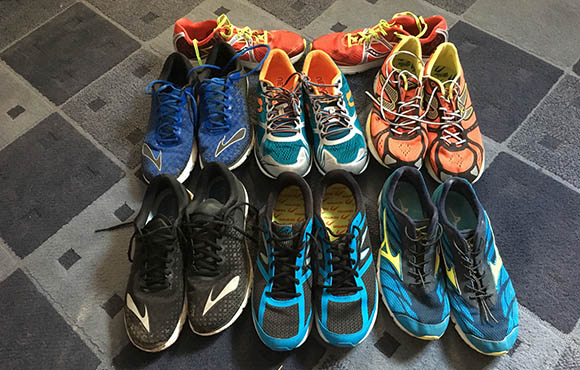
At what (x,y) coordinates should I click in order to perform the action: click on light gray carpet tile. Please return your answer as a coordinate pair (x, y). Looking at the image, I should click on (83, 257), (21, 116), (255, 13), (382, 11), (514, 25), (485, 147), (427, 354).